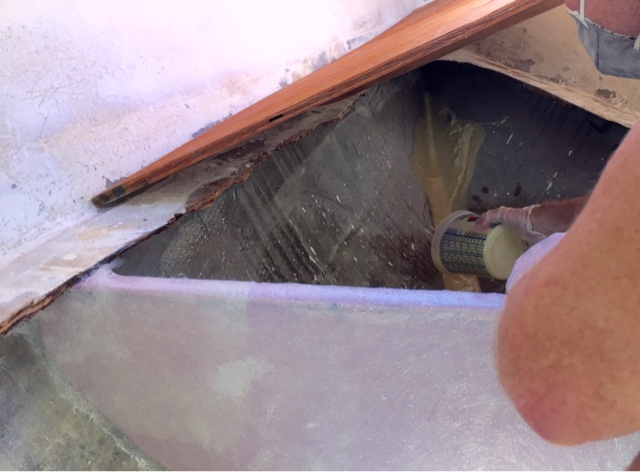
You are a GUI agent. You are given a task and a screenshot of the screen. Output one action in this format:
    pyautogui.click(x=<x>, y=<y>)
    Task: Click on the board
    Image resolution: width=640 pixels, height=472 pixels.
    Given the screenshot: What is the action you would take?
    pyautogui.click(x=429, y=51)